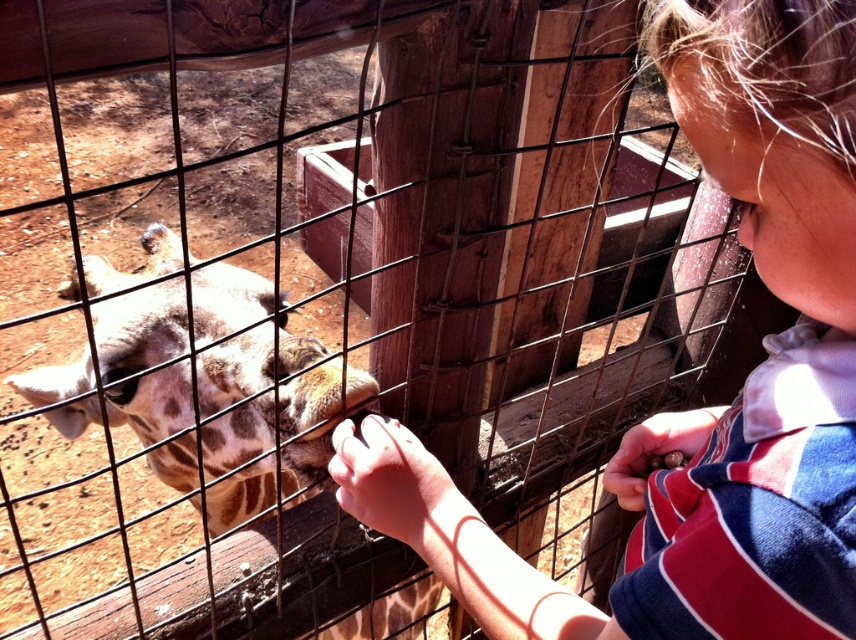
You are a zookeeper responsible for ensuring visitor safety. You notice a child interacting with a giraffe through the fence. The child is standing at point [198,417]. The zoo requires that visitors must stay at least 30 inches away from the animals at all times. Is the child currently in compliance with this safety rule?

The distance between the child at point [198,417] and the camera is 28.57 inches, which is less than the required 30 inches. Therefore, the child is not in compliance with the safety rule and needs to move further back.